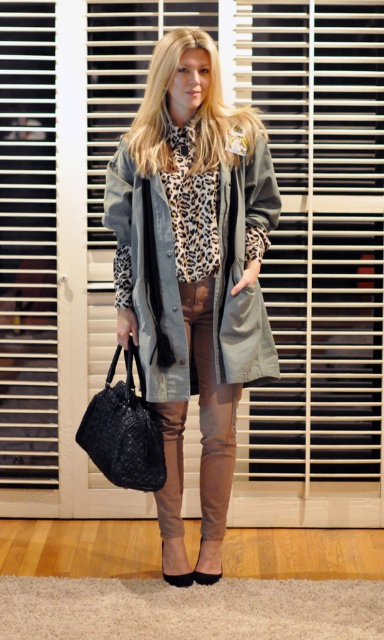
Question: Does matte olive green trench coat at center have a greater width compared to leopard print fabric scarf at center?

Choices:
 (A) no
 (B) yes

Answer: (B)

Question: Which point is farther to the camera?

Choices:
 (A) leopard print fabric scarf at center
 (B) black woven handbag at lower left
 (C) matte olive green trench coat at center

Answer: (A)

Question: Is black woven handbag at lower left smaller than leopard print fabric scarf at center?

Choices:
 (A) yes
 (B) no

Answer: (B)

Question: Which of these objects is positioned farthest from the matte olive green trench coat at center?

Choices:
 (A) black woven handbag at lower left
 (B) leopard print fabric scarf at center

Answer: (A)

Question: Can you confirm if matte olive green trench coat at center is positioned above black woven handbag at lower left?

Choices:
 (A) no
 (B) yes

Answer: (B)

Question: Based on their relative distances, which object is farther from the matte olive green trench coat at center?

Choices:
 (A) leopard print fabric scarf at center
 (B) black woven handbag at lower left

Answer: (B)